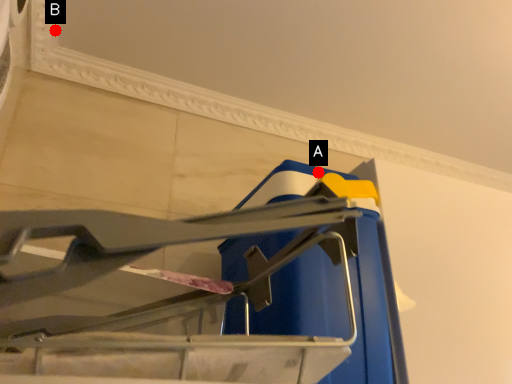
Question: Two points are circled on the image, labeled by A and B beside each circle. Which point is closer to the camera?

Choices:
 (A) A is closer
 (B) B is closer

Answer: (A)